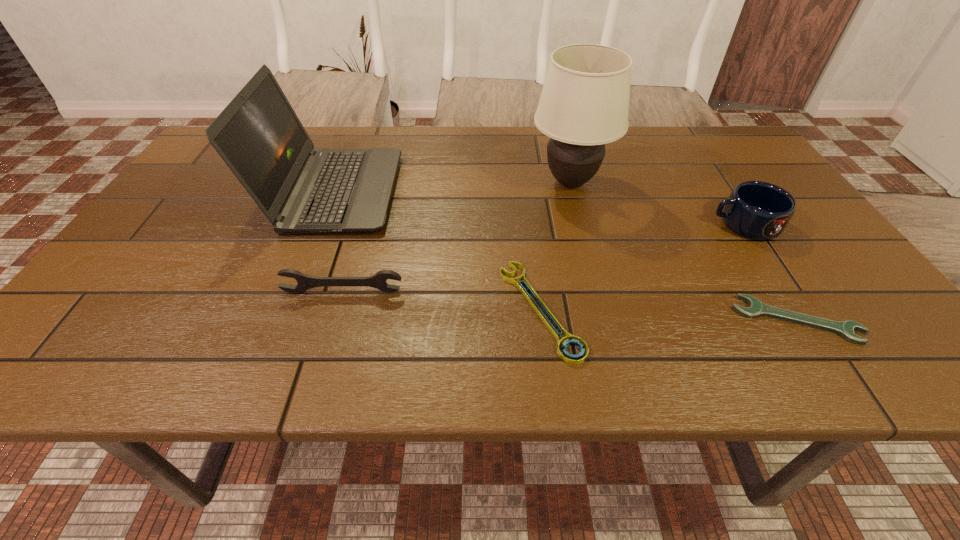
Where is `vacant space located 0.380m with the handle on the side of the mug`? The height and width of the screenshot is (540, 960). vacant space located 0.380m with the handle on the side of the mug is located at coordinates (553, 224).

The height and width of the screenshot is (540, 960). I want to click on vacant space situated 0.070m with the handle on the side of the mug, so click(x=682, y=224).

Where is `free space located 0.080m on the open ends of the leftmost wrench`? free space located 0.080m on the open ends of the leftmost wrench is located at coordinates [x=333, y=325].

You are a GUI agent. You are given a task and a screenshot of the screen. Output one action in this format:
    pyautogui.click(x=<x>, y=<y>)
    Task: Click on the vacant region located 0.060m on the back of the rightmost wrench
    This screenshot has width=960, height=540.
    Given the screenshot: What is the action you would take?
    pyautogui.click(x=769, y=276)

You are a GUI agent. You are given a task and a screenshot of the screen. Output one action in this format:
    pyautogui.click(x=<x>, y=<y>)
    Task: Click on the vacant region located on the left of the second wrench from right to left
    This screenshot has height=540, width=960.
    Given the screenshot: What is the action you would take?
    pyautogui.click(x=436, y=309)

Identify the location of lampshade that is at the far edge. The height and width of the screenshot is (540, 960). (584, 104).

You are a GUI agent. You are given a task and a screenshot of the screen. Output one action in this format:
    pyautogui.click(x=<x>, y=<y>)
    Task: Click on the laptop_computer located at the far edge
    
    Given the screenshot: What is the action you would take?
    pyautogui.click(x=258, y=135)

What are the coordinates of `mug at the right edge` in the screenshot? It's located at (757, 210).

Locate an element on the screen. Image resolution: width=960 pixels, height=540 pixels. wrench that is positioned at the right edge is located at coordinates (756, 308).

Locate an element on the screen. Image resolution: width=960 pixels, height=540 pixels. object situated at the near right corner is located at coordinates (756, 308).